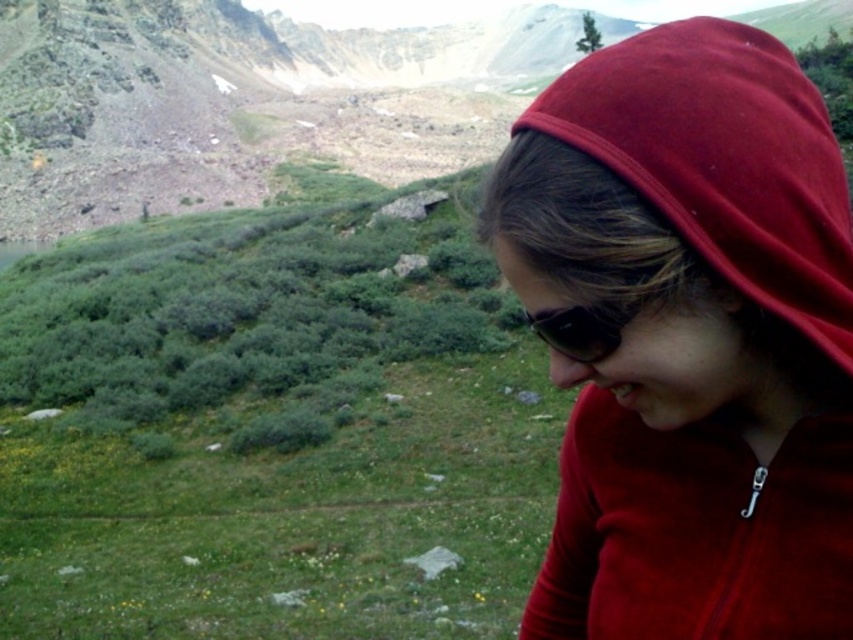
You are a photographer trying to capture a wide shot of the person in the matte red hoodie at right and their black reflective sunglasses at lower right. Given that your camera has a maximum focus range of 5 meters, will you be able to capture both subjects clearly in the same frame without moving the camera?

The matte red hoodie at right and black reflective sunglasses at lower right are 5.55 meters apart from each other. Since the distance between them exceeds the camera maximum focus range of 5 meters, you won not be able to capture both subjects clearly in the same frame without moving the camera.

You are a photographer trying to capture the person in the matte red hoodie at right and the black reflective sunglasses at lower right. Which object should you focus on first if you want to prioritize the one that appears larger in the frame?

The matte red hoodie at right has a greater height compared to the black reflective sunglasses at lower right, so you should focus on the matte red hoodie at right first since it appears larger in the frame.